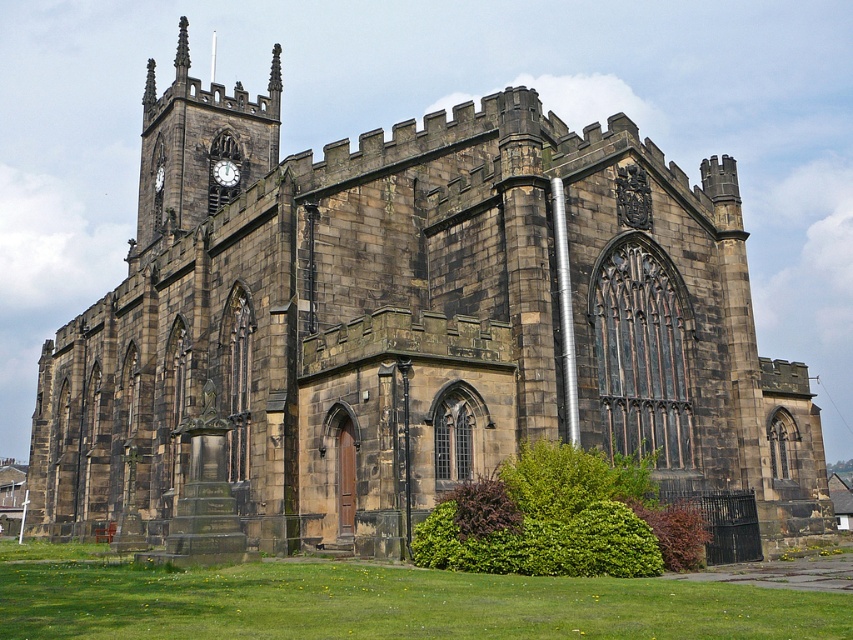
You are a gardener planning to trim the green leafy bush at lower center and the matte black clock at upper left. Which object requires more horizontal space to maintain its current shape?

The green leafy bush at lower center requires more horizontal space to maintain its current shape because its width surpasses that of the matte black clock at upper left.